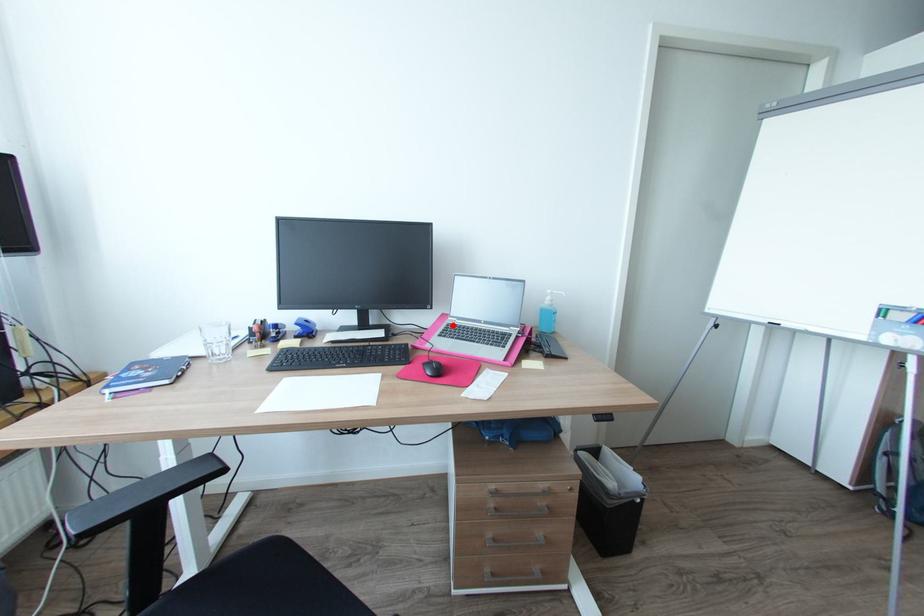
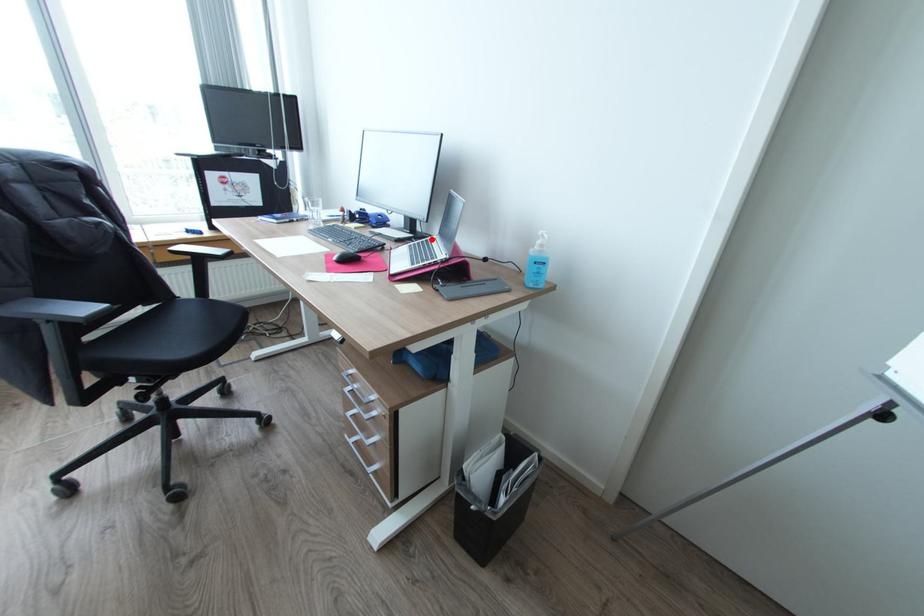
I am providing you with two images of the same scene from different viewpoints. A red point is marked on the first image and another point is marked on the second image. Is the red point in image1 aligned with the point shown in image2?

Yes